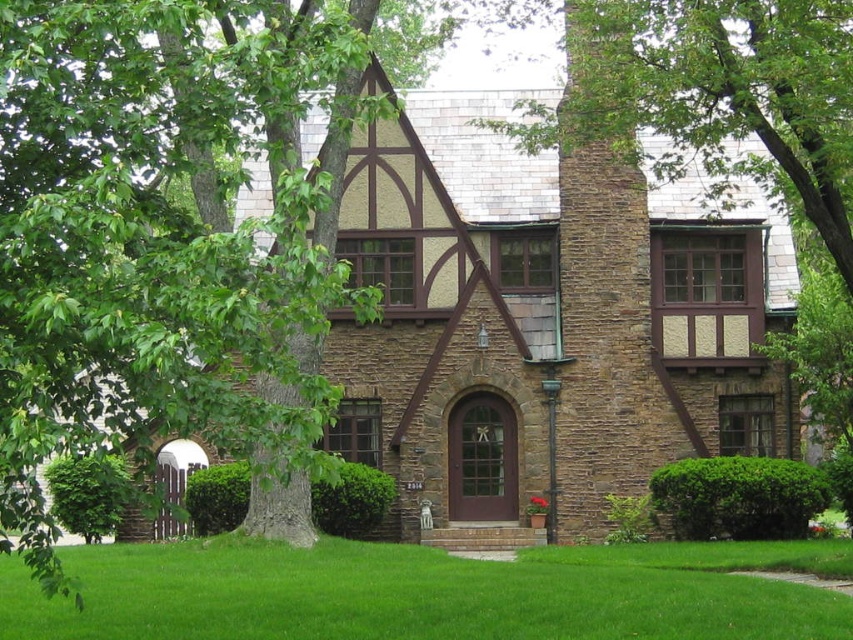
Question: Is green grass at lower center further to the viewer compared to brown stone chimney at upper right?

Choices:
 (A) yes
 (B) no

Answer: (B)

Question: Is green grass at lower center bigger than brown stone chimney at upper right?

Choices:
 (A) yes
 (B) no

Answer: (B)

Question: Observing the image, what is the correct spatial positioning of green grass at lower center in reference to brown stone chimney at upper right?

Choices:
 (A) left
 (B) right

Answer: (A)

Question: Which of the following is the closest to the observer?

Choices:
 (A) click(x=577, y=125)
 (B) click(x=844, y=547)

Answer: (B)

Question: Among these objects, which one is nearest to the camera?

Choices:
 (A) green grass at lower center
 (B) brown stone chimney at upper right

Answer: (A)